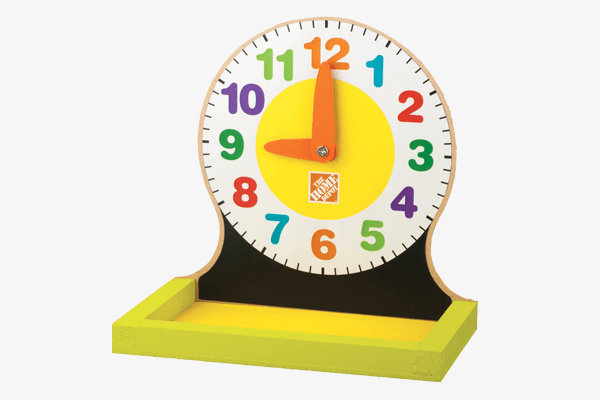
You are a GUI agent. You are given a task and a screenshot of the screen. Output one action in this format:
    pyautogui.click(x=<x>, y=<y>)
    Task: Click on the colorful clock
    This screenshot has height=400, width=600.
    Given the screenshot: What is the action you would take?
    pyautogui.click(x=224, y=64)